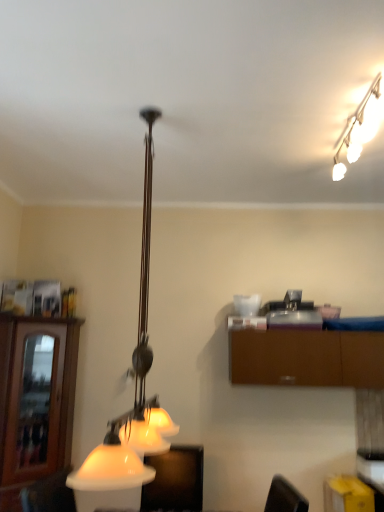
Question: From the image's perspective, is brown wood cabinet at left, which appears as the 2th cabinetry when viewed from the right, above or below matte white lampshade at lower center?

Choices:
 (A) below
 (B) above

Answer: (B)

Question: Choose the correct answer: Is brown wood cabinet at left, which is counted as the 1th cabinetry, starting from the left, inside matte white lampshade at lower center or outside it?

Choices:
 (A) inside
 (B) outside

Answer: (B)

Question: Which object is positioned farthest from the white frosted glass light fixture at upper right, which is counted as the 2th lamp, starting from the left?

Choices:
 (A) white glossy lamp at center, which ranks as the first lamp in left-to-right order
 (B) brown matte cabinet at upper right, the first cabinetry from the right
 (C) brown wood cabinet at left, which appears as the 2th cabinetry when viewed from the right
 (D) matte white lampshade at lower center

Answer: (C)

Question: Which object is the farthest from the brown matte cabinet at upper right, acting as the second cabinetry starting from the left?

Choices:
 (A) matte white lampshade at lower center
 (B) white glossy lamp at center, which ranks as the first lamp in left-to-right order
 (C) white frosted glass light fixture at upper right, which ranks as the 1th lamp in right-to-left order
 (D) brown wood cabinet at left, which appears as the 2th cabinetry when viewed from the right

Answer: (D)